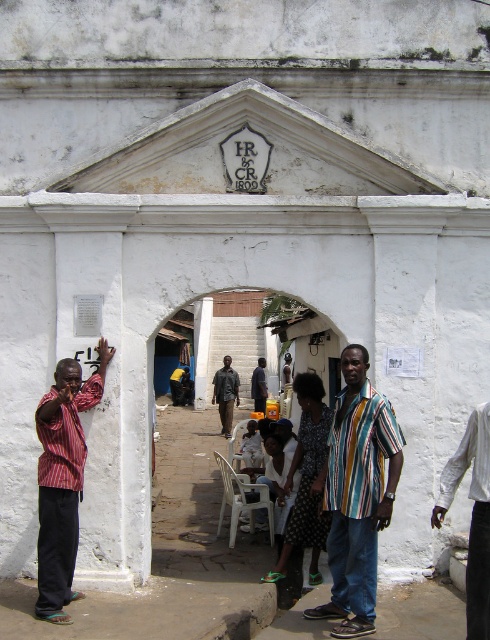
Question: Which of the following is the closest to the observer?

Choices:
 (A) white cotton shirt at right
 (B) dark brown leather jacket at center
 (C) striped cotton shirt at center
 (D) striped fabric shirt at left

Answer: (A)

Question: Is striped fabric shirt at left in front of dark brown leather jacket at center?

Choices:
 (A) yes
 (B) no

Answer: (A)

Question: Is dark brown leather jacket at center positioned before dark blue shirt at center?

Choices:
 (A) yes
 (B) no

Answer: (A)

Question: Which of the following is the closest to the observer?

Choices:
 (A) dark brown leather jacket at center
 (B) striped cotton shirt at center
 (C) white cotton shirt at right
 (D) dark blue shirt at center

Answer: (C)

Question: Can you confirm if striped cotton shirt at center is positioned to the left of dark blue shirt at center?

Choices:
 (A) yes
 (B) no

Answer: (B)

Question: Which object is closer to the camera taking this photo?

Choices:
 (A) striped fabric shirt at left
 (B) white cotton shirt at right
 (C) striped cotton shirt at center
 (D) dark brown leather jacket at center

Answer: (B)